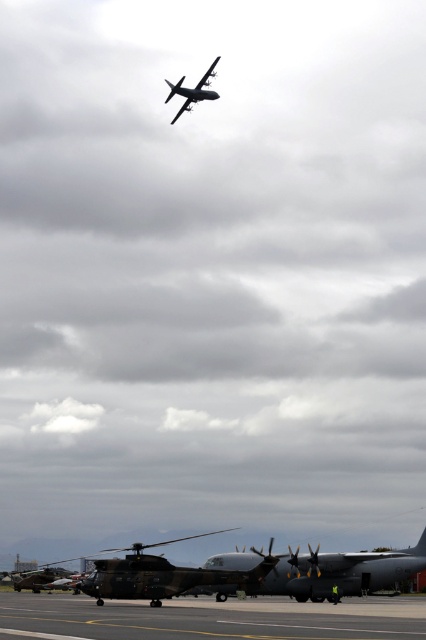
Between matte gray airplane at center and camouflage paint helicopter at lower center, which one is positioned higher?

Positioned higher is matte gray airplane at center.

The width and height of the screenshot is (426, 640). I want to click on matte gray airplane at center, so click(x=340, y=572).

Can you confirm if matte gray airplane at center is bigger than metallic gray airplane at upper center?

No.

Is matte gray airplane at center to the left of metallic gray airplane at upper center from the viewer's perspective?

Incorrect, matte gray airplane at center is not on the left side of metallic gray airplane at upper center.

Describe the element at coordinates (340, 572) in the screenshot. Image resolution: width=426 pixels, height=640 pixels. I see `matte gray airplane at center` at that location.

In order to click on matte gray airplane at center in this screenshot , I will do `click(340, 572)`.

Which is in front, point (296, 605) or point (180, 115)?

Point (296, 605) is more forward.

In the scene shown: Is concrete tarmac at lower center in front of metallic gray airplane at upper center?

Yes, it is in front of metallic gray airplane at upper center.

Is point (74, 634) farther from viewer compared to point (203, 77)?

No, it is in front of (203, 77).

Find the location of a particular element. concrete tarmac at lower center is located at coordinates (213, 618).